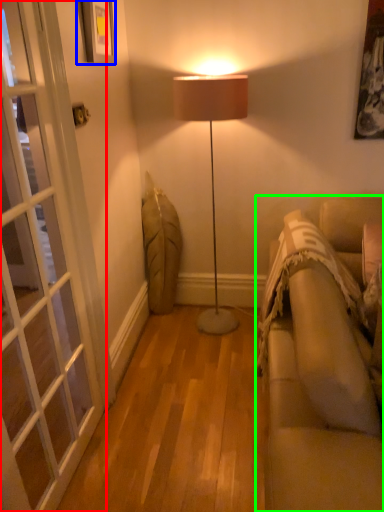
Question: Which is farther away from screen door (highlighted by a red box)? picture frame (highlighted by a blue box) or studio couch (highlighted by a green box)?

Choices:
 (A) picture frame
 (B) studio couch

Answer: (B)